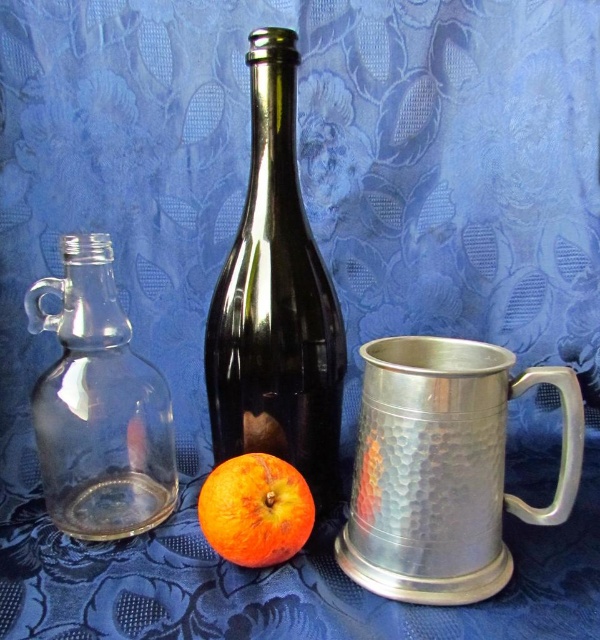
Question: Is hammered silver mug at center right to the left of shiny dark glass bottle at center from the viewer's perspective?

Choices:
 (A) yes
 (B) no

Answer: (B)

Question: Which of these objects is positioned farthest from the transparent glass carafe at left?

Choices:
 (A) orangesmoothorange at center
 (B) hammered silver mug at center right
 (C) shiny dark glass bottle at center

Answer: (B)

Question: Does shiny dark glass bottle at center have a greater width compared to transparent glass carafe at left?

Choices:
 (A) yes
 (B) no

Answer: (B)

Question: Estimate the real-world distances between objects in this image. Which object is closer to the orangesmoothorange at center?

Choices:
 (A) transparent glass carafe at left
 (B) hammered silver mug at center right

Answer: (B)

Question: Which of these objects is positioned closest to the orangesmoothorange at center?

Choices:
 (A) shiny dark glass bottle at center
 (B) hammered silver mug at center right

Answer: (B)

Question: From the image, what is the correct spatial relationship of hammered silver mug at center right in relation to shiny dark glass bottle at center?

Choices:
 (A) below
 (B) above

Answer: (A)